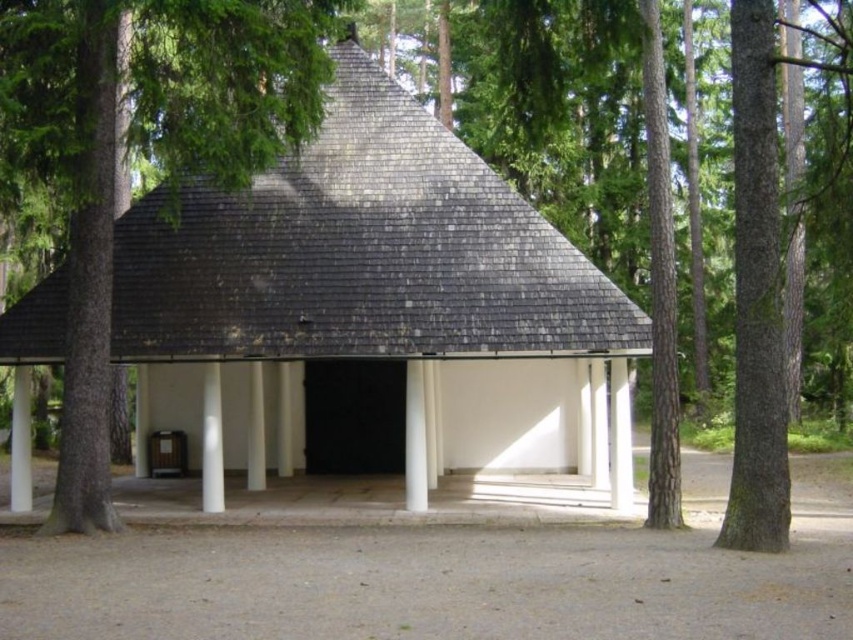
Who is shorter, wooden shingles hut at center or brown rough bark tree at right?

brown rough bark tree at right is shorter.

Does wooden shingles hut at center appear under brown rough bark tree at right?

Incorrect, wooden shingles hut at center is not positioned below brown rough bark tree at right.

Locate an element on the screen. wooden shingles hut at center is located at coordinates (367, 301).